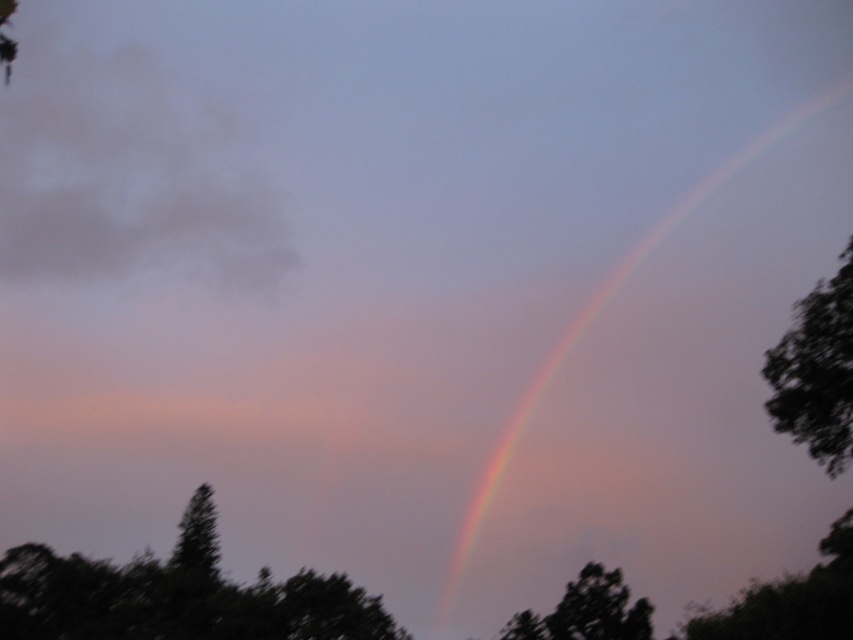
Question: Which point is farther from the camera taking this photo?

Choices:
 (A) (589, 611)
 (B) (90, 561)
 (C) (804, 435)
 (D) (498, 442)

Answer: (D)

Question: Which point is closer to the camera taking this photo?

Choices:
 (A) (763, 378)
 (B) (134, 604)

Answer: (A)

Question: Which of the following is the closest to the observer?

Choices:
 (A) (618, 577)
 (B) (67, 572)
 (C) (831, 97)

Answer: (B)

Question: Does dark green leafy tree at lower left appear on the left side of rainbow at upper right?

Choices:
 (A) yes
 (B) no

Answer: (A)

Question: Can you confirm if rainbow at upper right is positioned to the left of green leafy tree at lower center?

Choices:
 (A) yes
 (B) no

Answer: (B)

Question: Can you confirm if dark green leafy tree at right is smaller than green leafy tree at lower center?

Choices:
 (A) yes
 (B) no

Answer: (B)